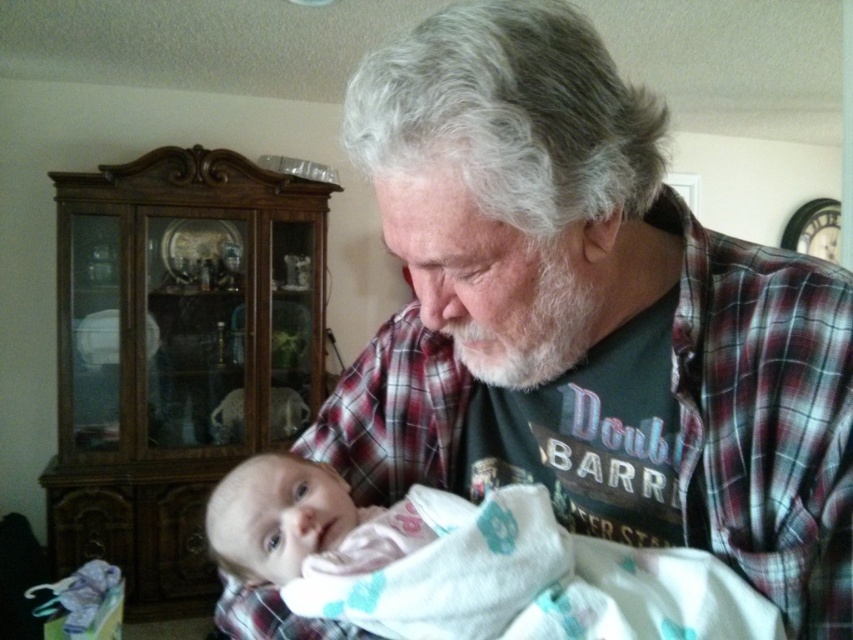
You are standing in the room and want to move from the point at coordinate (502, 214) to the point at coordinate (344, 586). Which direction should you move to get closer to your destination?

You should move backward because point (502, 214) is in front of point (344, 586), so moving backward will bring you closer to your destination.

You are a photographer taking a picture of the plaid flannel shirt at center and the white soft swaddling blanket at center. Which object should you focus on first if you want to capture both in the same frame without moving the camera?

The plaid flannel shirt at center is larger in size than the white soft swaddling blanket at center, so you should focus on the plaid flannel shirt at center first to ensure it is in sharp focus before the smaller blanket.